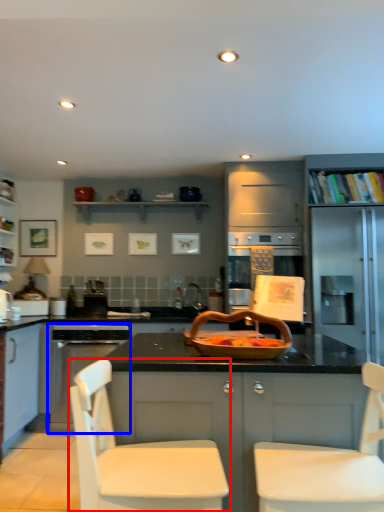
Question: Among these objects, which one is farthest to the camera, chair (highlighted by a red box) or kitchen appliance (highlighted by a blue box)?

Choices:
 (A) chair
 (B) kitchen appliance

Answer: (B)